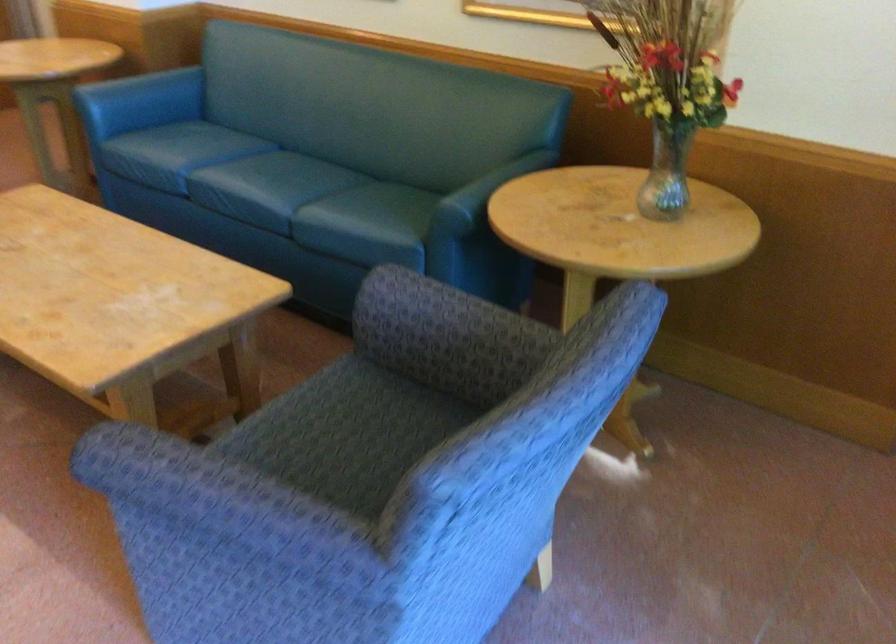
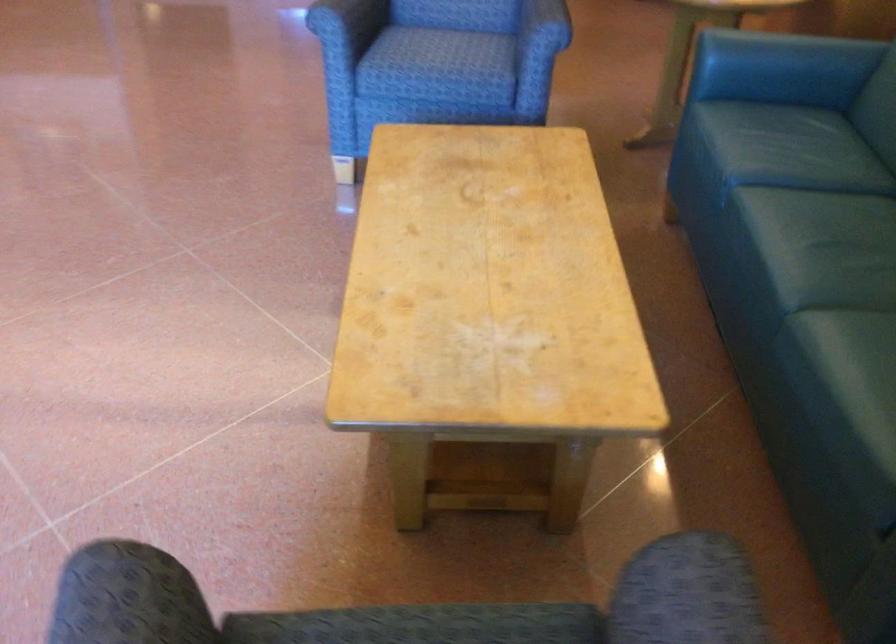
Find the pixel in the second image that matches [152,86] in the first image.

(785, 53)